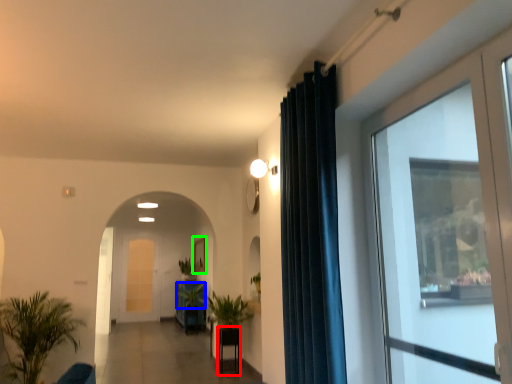
Question: Estimate the real-world distances between objects in this image. Which object is closer to furniture (highlighted by a red box), plant (highlighted by a blue box) or picture frame (highlighted by a green box)?

Choices:
 (A) plant
 (B) picture frame

Answer: (A)